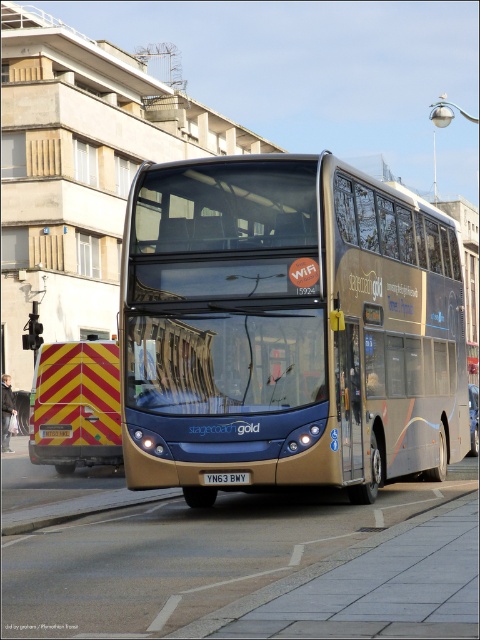
Is yellow/red striped reflector at rear shorter than white plastic license plate at center?

Incorrect, yellow/red striped reflector at rear's height does not fall short of white plastic license plate at center's.

Where is `yellow/red striped reflector at rear`? yellow/red striped reflector at rear is located at coordinates (75, 404).

At what (x,y) coordinates should I click in order to perform the action: click on yellow/red striped reflector at rear. Please return your answer as a coordinate pair (x, y). Looking at the image, I should click on click(75, 404).

Locate an element on the screen. The height and width of the screenshot is (640, 480). yellow/red striped reflector at rear is located at coordinates (75, 404).

Does gold metallic bus at center lie in front of yellow/red striped reflector at rear?

Yes, it is.

Where is `gold metallic bus at center`? The width and height of the screenshot is (480, 640). gold metallic bus at center is located at coordinates point(287,328).

Which is behind, point (427, 248) or point (84, 452)?

Point (84, 452)

Where is `gold metallic bus at center`? gold metallic bus at center is located at coordinates (287, 328).

Who is more distant from viewer, (x=242, y=268) or (x=226, y=476)?

Result: The point (x=242, y=268) is more distant.

Between gold metallic bus at center and white plastic license plate at center, which one appears on the left side from the viewer's perspective?

Positioned to the left is white plastic license plate at center.

The height and width of the screenshot is (640, 480). Identify the location of gold metallic bus at center. (287, 328).